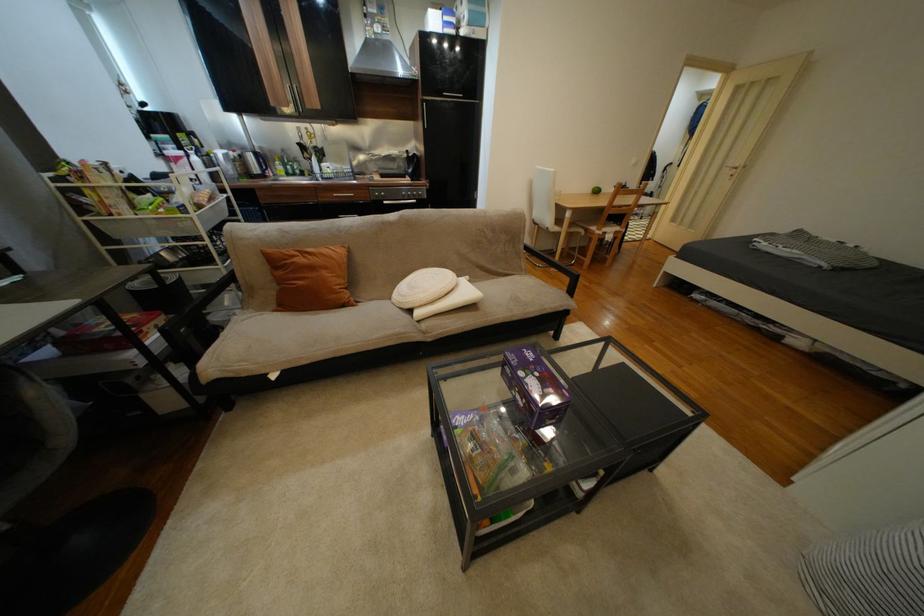
Where is `green apple`? This screenshot has height=616, width=924. green apple is located at coordinates (606, 188).